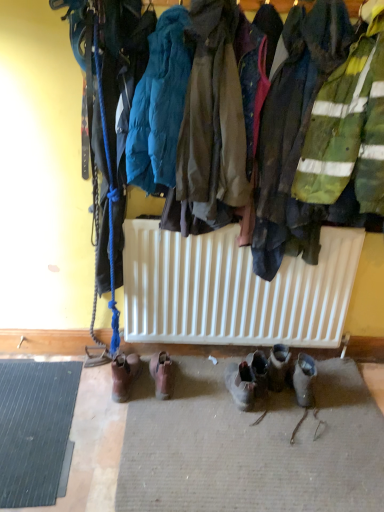
Question: Is teal puffy jacket at upper center, marked as the second jacket in a right-to-left arrangement, directly adjacent to brown leather boots at center, placed as the third footwear when sorted from right to left?

Choices:
 (A) yes
 (B) no

Answer: (B)

Question: Is brown leather boots at center, positioned as the 2th footwear in left-to-right order, a part of teal puffy jacket at upper center, which appears as the first jacket when viewed from the left?

Choices:
 (A) yes
 (B) no

Answer: (B)

Question: Considering the relative sizes of teal puffy jacket at upper center, which appears as the first jacket when viewed from the left, and brown leather boots at center, positioned as the 2th footwear in left-to-right order, in the image provided, is teal puffy jacket at upper center, which appears as the first jacket when viewed from the left, thinner than brown leather boots at center, positioned as the 2th footwear in left-to-right order,?

Choices:
 (A) no
 (B) yes

Answer: (B)

Question: Is teal puffy jacket at upper center, marked as the second jacket in a right-to-left arrangement, looking in the opposite direction of brown leather boots at center, placed as the third footwear when sorted from right to left?

Choices:
 (A) yes
 (B) no

Answer: (B)

Question: Can you confirm if teal puffy jacket at upper center, marked as the second jacket in a right-to-left arrangement, is taller than brown leather boots at center, placed as the third footwear when sorted from right to left?

Choices:
 (A) no
 (B) yes

Answer: (B)

Question: Can you confirm if teal puffy jacket at upper center, marked as the second jacket in a right-to-left arrangement, is bigger than brown leather boots at center, placed as the third footwear when sorted from right to left?

Choices:
 (A) no
 (B) yes

Answer: (B)

Question: Are black rubber mat at lower left and brown leather boots at lower center, the first footwear in the left-to-right sequence, located far from each other?

Choices:
 (A) yes
 (B) no

Answer: (B)

Question: Is black rubber mat at lower left positioned in front of brown leather boots at lower center, the first footwear in the left-to-right sequence?

Choices:
 (A) yes
 (B) no

Answer: (A)

Question: Is black rubber mat at lower left located outside brown leather boots at lower center, the first footwear in the left-to-right sequence?

Choices:
 (A) yes
 (B) no

Answer: (A)

Question: Is black rubber mat at lower left shorter than brown leather boots at lower center, the first footwear in the left-to-right sequence?

Choices:
 (A) no
 (B) yes

Answer: (B)

Question: Is black rubber mat at lower left turned away from brown leather boots at lower center, the 4th footwear viewed from the right?

Choices:
 (A) yes
 (B) no

Answer: (B)

Question: From the image's perspective, is black rubber mat at lower left beneath brown leather boots at lower center, the first footwear in the left-to-right sequence?

Choices:
 (A) yes
 (B) no

Answer: (A)

Question: From a real-world perspective, is brown fabric jacket at center, the 2th jacket positioned from the left, on brown leather boots at center, placed as the third footwear when sorted from right to left?

Choices:
 (A) yes
 (B) no

Answer: (A)